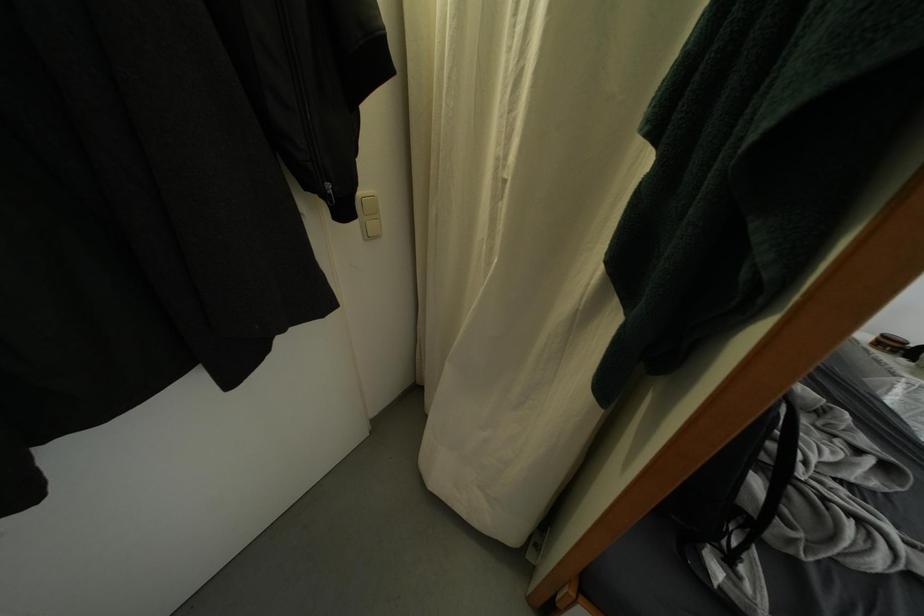
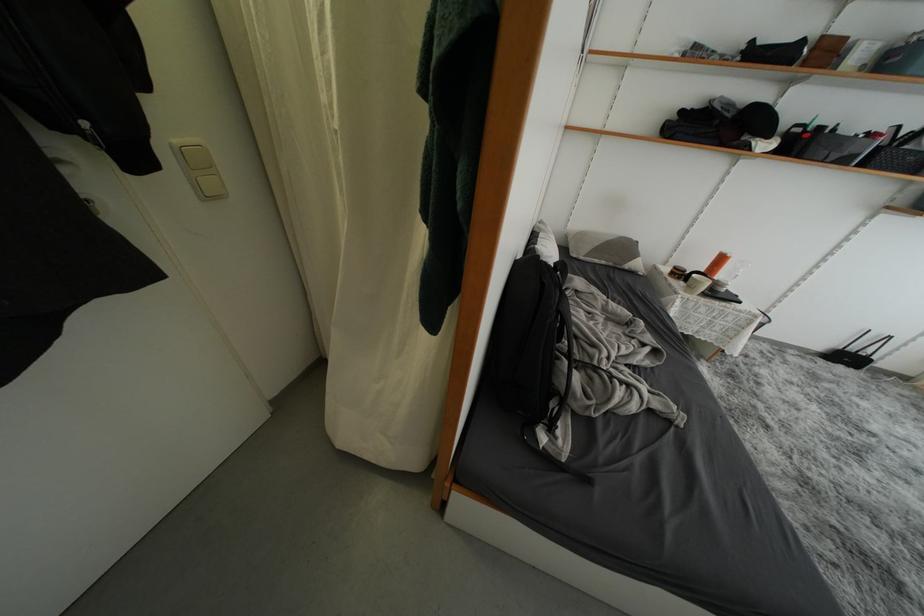
Question: The camera is either moving clockwise (left) or counter-clockwise (right) around the object. The first image is from the beginning of the video and the second image is from the end. Is the camera moving left or right when shooting the video?

Choices:
 (A) Left
 (B) Right

Answer: (A)